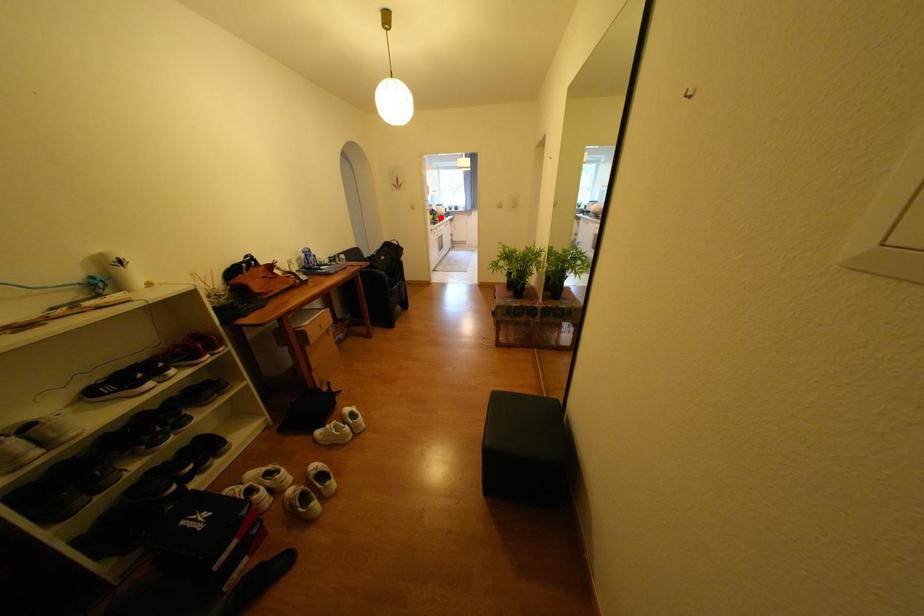
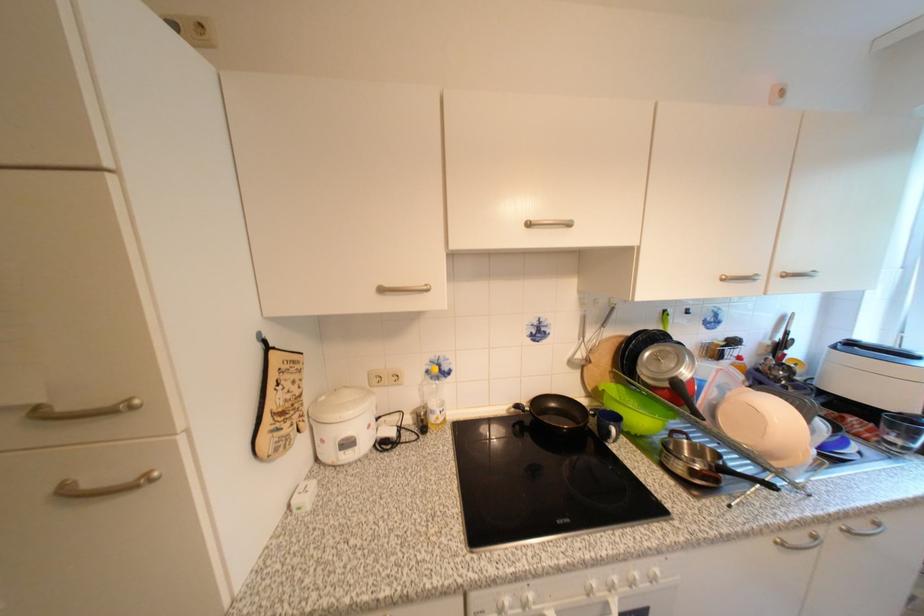
Find the pixel in the second image that matches the highlighted location in the first image.

(651, 421)